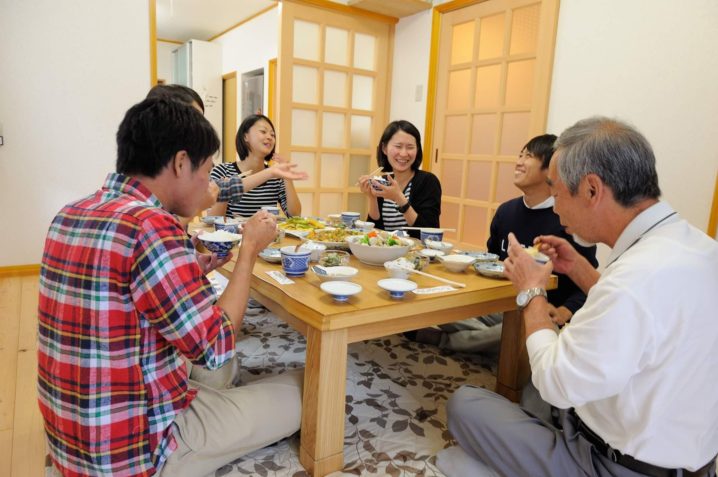
At what (x,y) coordinates should I click in order to perform the action: click on people sitting around table. Please return your answer as a coordinate pair (x, y). Looking at the image, I should click on (146, 267), (171, 93), (266, 136), (408, 175), (512, 200), (647, 266).